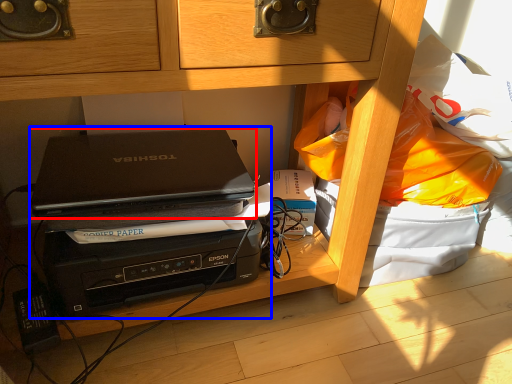
Question: Which object is further to the camera taking this photo, laptop (highlighted by a red box) or computer (highlighted by a blue box)?

Choices:
 (A) laptop
 (B) computer

Answer: (B)